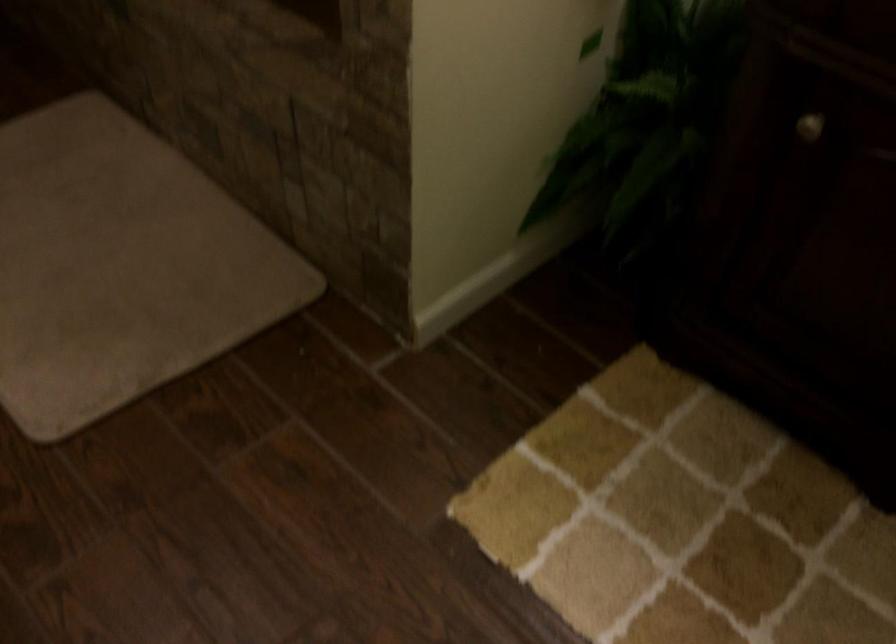
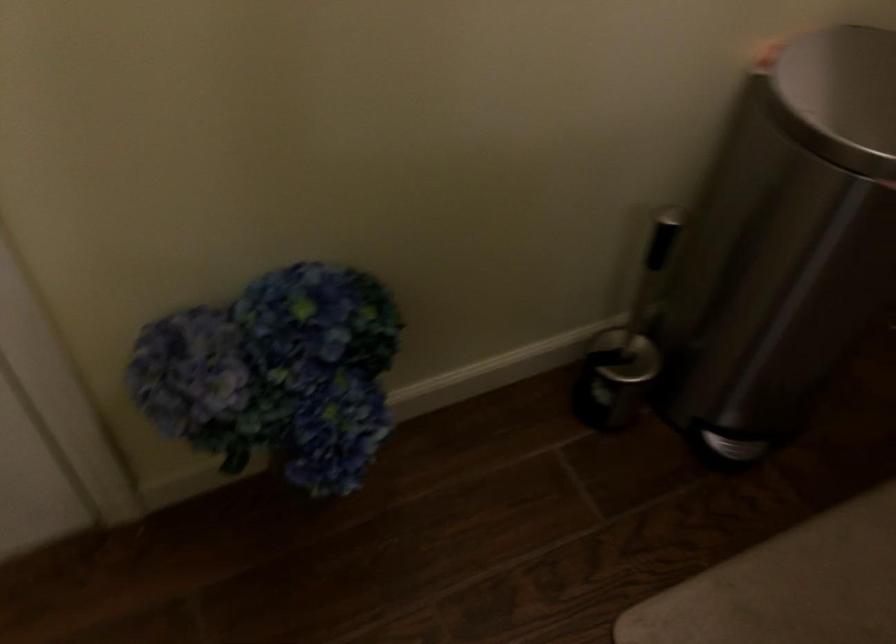
The first image is from the beginning of the video and the second image is from the end. How did the camera likely rotate when shooting the video?

The rotation direction of the camera is left-down.